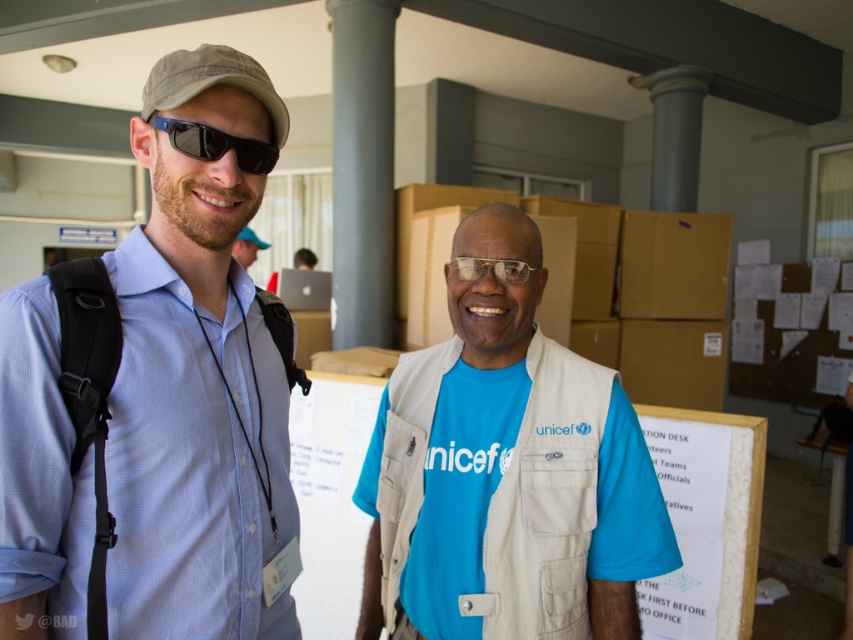
Question: Which object is the closest to the blue cotton shirt at center?

Choices:
 (A) matte black backpack at left
 (B) gray concrete pillar at center
 (C) sunglasses at left

Answer: (C)

Question: Which object is positioned closest to the transparent plastic glasses at center?

Choices:
 (A) sunglasses at left
 (B) blue cotton shirt at center
 (C) khaki fabric baseball cap at left
 (D) light blue shirt at center

Answer: (B)

Question: Is khaki fabric baseball cap at left positioned at the back of matte black backpack at left?

Choices:
 (A) no
 (B) yes

Answer: (A)

Question: Does blue cotton shirt at center have a lesser width compared to sunglasses at left?

Choices:
 (A) no
 (B) yes

Answer: (A)

Question: Can you confirm if blue cotton shirt at center is positioned to the left of matte black backpack at left?

Choices:
 (A) yes
 (B) no

Answer: (B)

Question: Among these points, which one is nearest to the camera?

Choices:
 (A) (277, 138)
 (B) (486, 262)
 (C) (233, 620)
 (D) (451, 429)

Answer: (C)